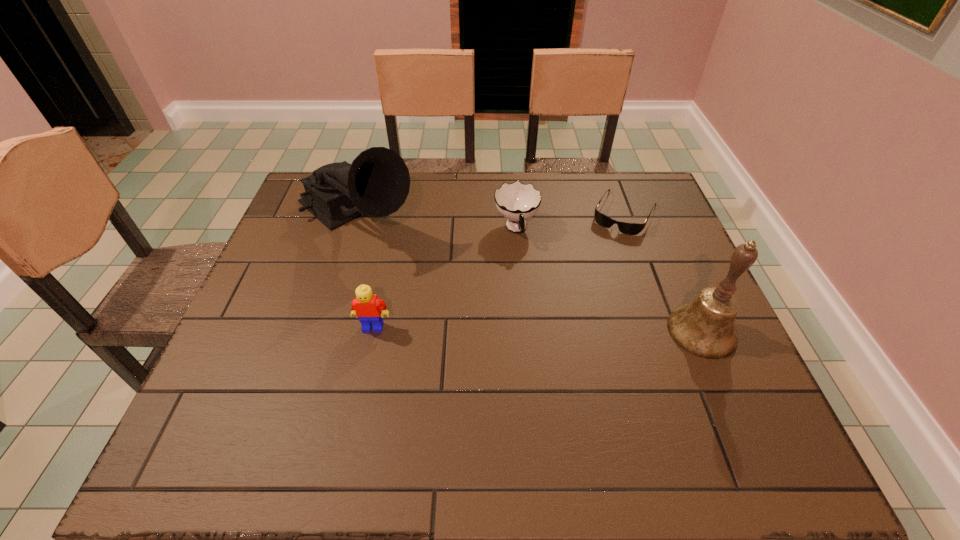
At what (x,y) coordinates should I click in order to perform the action: click on vacant area that lies between the phonograph_record and the second shortest object. Please return your answer as a coordinate pair (x, y). This screenshot has width=960, height=540. Looking at the image, I should click on (436, 223).

At what (x,y) coordinates should I click in order to perform the action: click on vacant space that's between the Lego and the phonograph_record. Please return your answer as a coordinate pair (x, y). Looking at the image, I should click on (365, 272).

Locate an element on the screen. This screenshot has width=960, height=540. free space between the Lego and the shortest object is located at coordinates (499, 269).

You are a GUI agent. You are given a task and a screenshot of the screen. Output one action in this format:
    pyautogui.click(x=<x>, y=<y>)
    Task: Click on the blank region between the bell and the sunglasses
    This screenshot has height=540, width=960.
    Given the screenshot: What is the action you would take?
    pyautogui.click(x=663, y=272)

Find the location of a particular element. The width and height of the screenshot is (960, 540). vacant area between the bell and the third object from right to left is located at coordinates (609, 280).

Where is `vacant space that is in between the phonograph_record and the third object from right to left`? The height and width of the screenshot is (540, 960). vacant space that is in between the phonograph_record and the third object from right to left is located at coordinates (x=436, y=223).

The image size is (960, 540). Identify the location of vacant area between the phonograph_record and the bell. (529, 274).

Where is `free space between the bell and the shortest object`? free space between the bell and the shortest object is located at coordinates (663, 272).

You are a GUI agent. You are given a task and a screenshot of the screen. Output one action in this format:
    pyautogui.click(x=<x>, y=<y>)
    Task: Click on the unoccupied position between the third object from right to left and the third tallest object
    The width and height of the screenshot is (960, 540).
    Given the screenshot: What is the action you would take?
    pyautogui.click(x=444, y=278)

Where is `vacant point located between the Lego and the phonograph_record`? vacant point located between the Lego and the phonograph_record is located at coordinates (365, 272).